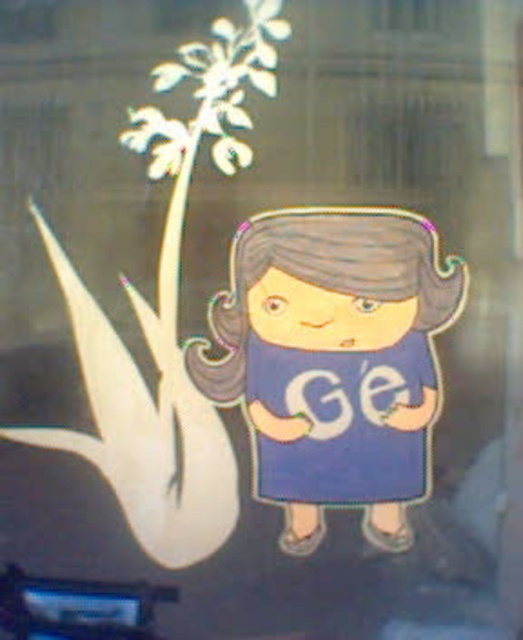
You are helping a costume designer choose between two dresses for a character. The character needs to wear a dress that is the larger option. Which dress should they choose between the matte blue dress at center and the blue fabric dress at center?

The matte blue dress at center is larger in size than the blue fabric dress at center, so the character should choose the matte blue dress at center.

You are standing in front of the image and want to touch the dress that is closer to you. Which one should you choose between the matte blue dress at center and the blue fabric dress at center?

The matte blue dress at center is closer to the viewer than the blue fabric dress at center, so you should choose the matte blue dress at center.

You are an assistant helping a customer find a dress in a store. The customer says they want a dress that is exactly the same as the one in the image but made of a different fabric. You show them two dresses from the options available. The first is the matte blue dress at center, and the second is the blue fabric dress at center. Which dress should the customer choose if they want the one made of a different fabric?

The customer should choose the blue fabric dress at center because the matte blue dress at center is to the left of it, indicating they are separate options with different fabrics.